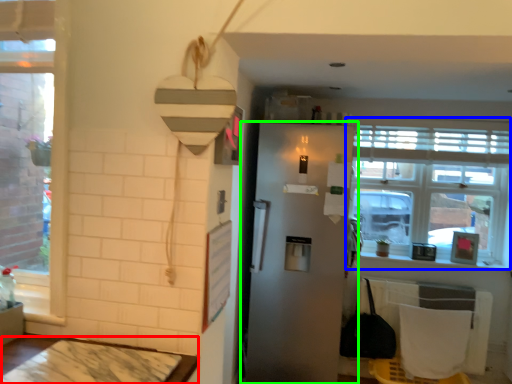
Question: Considering the real-world distances, which object is farthest from table (highlighted by a red box)? window (highlighted by a blue box) or refrigerator (highlighted by a green box)?

Choices:
 (A) window
 (B) refrigerator

Answer: (A)